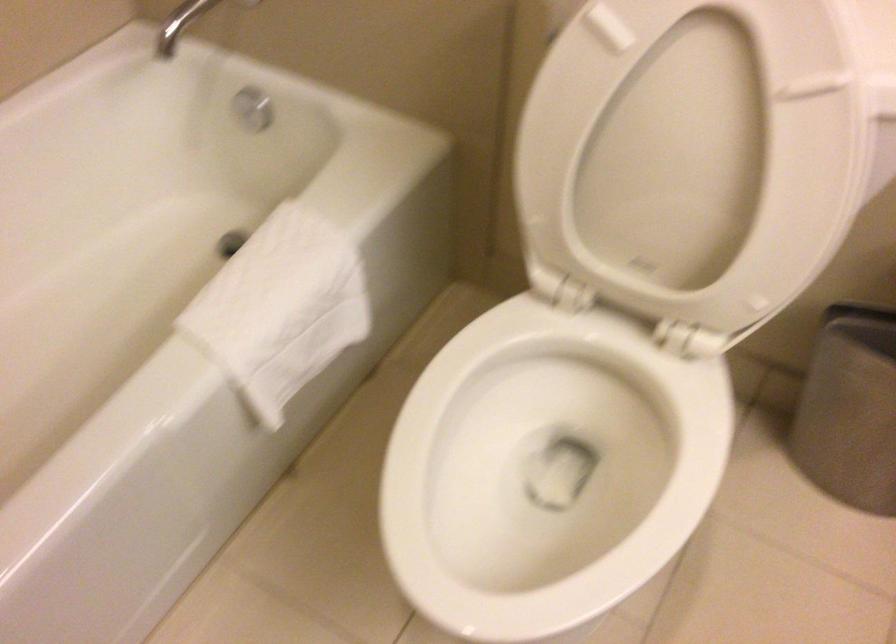
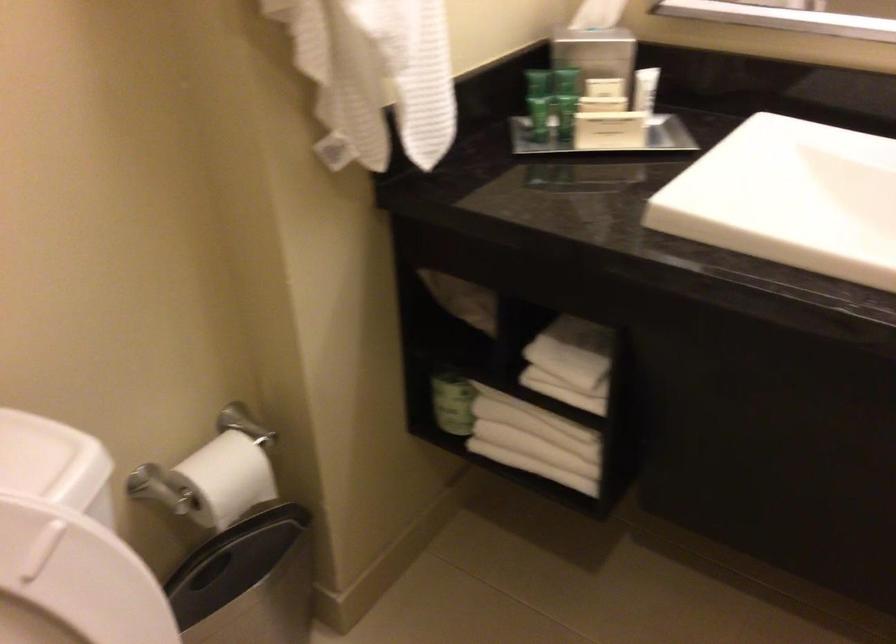
Consider the image. The images are taken continuously from a first-person perspective. In which direction is your viewpoint rotating?

The camera rotated toward right-down.